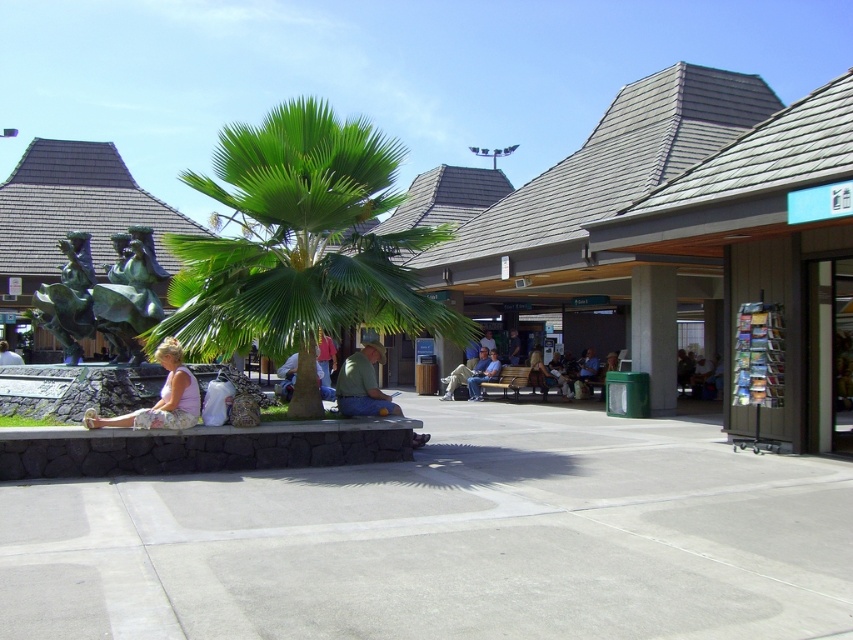
Can you confirm if light pink fabric skirt at lower left is smaller than light blue jeans at center?

Correct, light pink fabric skirt at lower left occupies less space than light blue jeans at center.

Is light pink fabric skirt at lower left shorter than light blue jeans at center?

Correct, light pink fabric skirt at lower left is not as tall as light blue jeans at center.

Image resolution: width=853 pixels, height=640 pixels. Find the location of `light pink fabric skirt at lower left`. light pink fabric skirt at lower left is located at coordinates (161, 397).

Where is `light pink fabric skirt at lower left`? The height and width of the screenshot is (640, 853). light pink fabric skirt at lower left is located at coordinates [161, 397].

Is green leafy palm tree at center wider than light pink fabric skirt at lower left?

Yes.

Between point (331, 262) and point (171, 378), which one is positioned behind?

Point (331, 262)

Describe the element at coordinates (299, 244) in the screenshot. Image resolution: width=853 pixels, height=640 pixels. I see `green leafy palm tree at center` at that location.

Find the location of a particular element. This screenshot has height=640, width=853. green leafy palm tree at center is located at coordinates (299, 244).

Looking at this image, is green metallic statue at left below light brown leather jacket at center?

No, green metallic statue at left is not below light brown leather jacket at center.

Does green metallic statue at left appear over light brown leather jacket at center?

Yes, green metallic statue at left is above light brown leather jacket at center.

Does point (669, 205) lie in front of point (450, 387)?

Yes, it is.

Where is `green metallic statue at left`? The image size is (853, 640). green metallic statue at left is located at coordinates (689, 243).